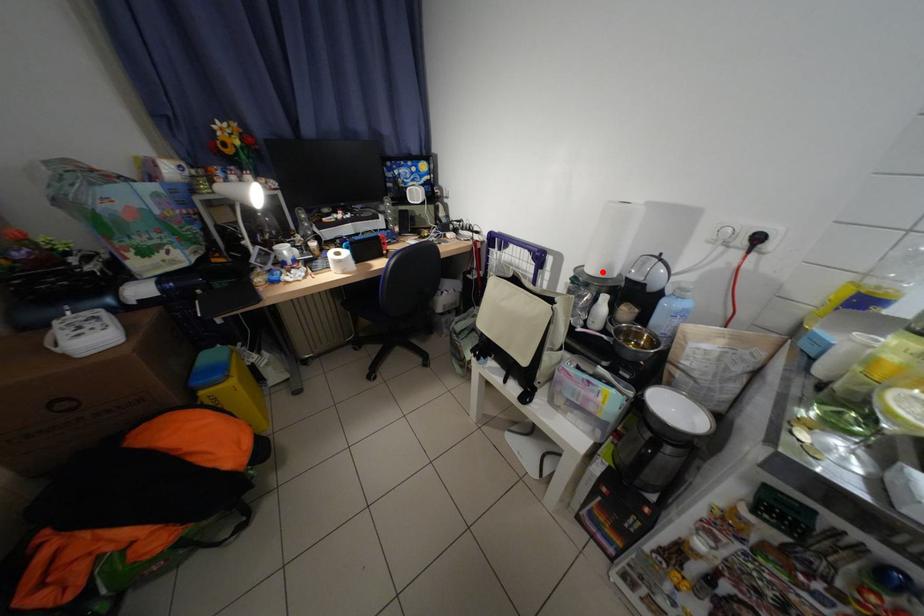
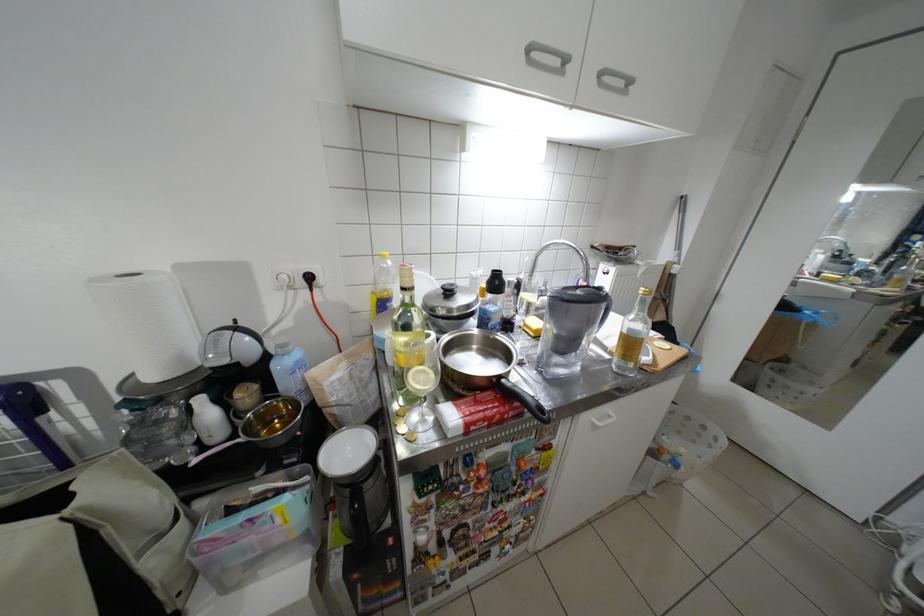
Find the pixel in the second image that matches the highlighted location in the first image.

(164, 378)